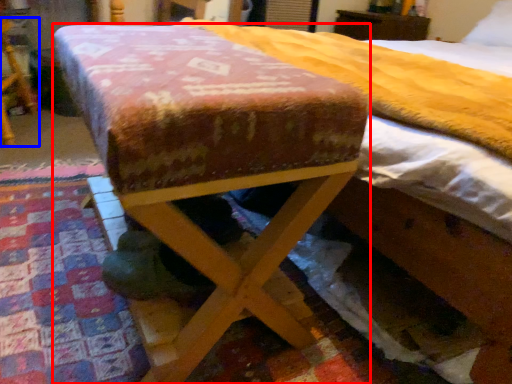
Question: Which object is closer to the camera taking this photo, furniture (highlighted by a red box) or furniture (highlighted by a blue box)?

Choices:
 (A) furniture
 (B) furniture

Answer: (A)